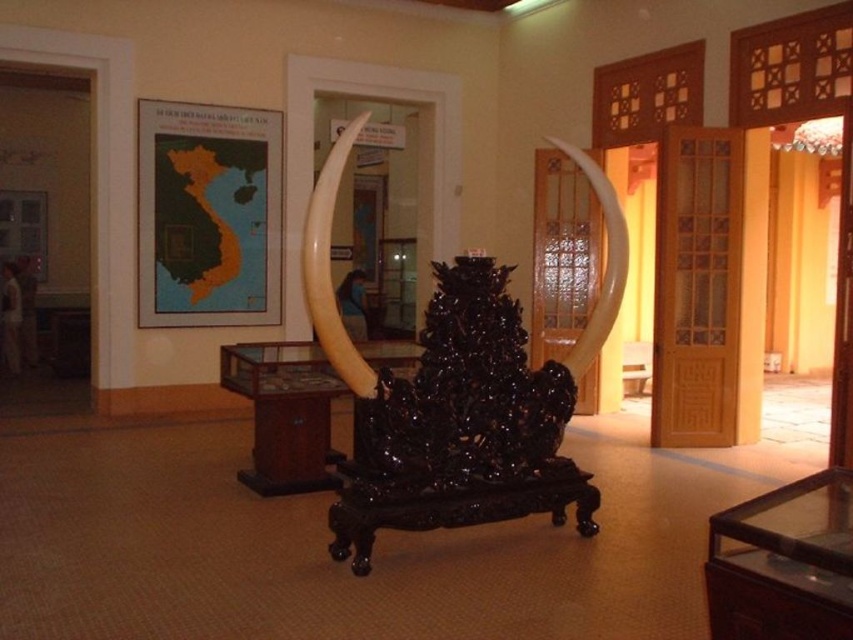
You are an art curator planning to move the black polished wood sculpture at center and the ivory tusk at center to a new gallery space. The new space has a narrow doorway that allows objects up to 1.2 meters in width. Based on the current dimensions, which object might require careful handling to ensure it fits through the doorway?

The black polished wood sculpture at center has a larger width than the ivory tusk at center, so it might require careful handling to ensure it fits through the doorway since it could exceed the 1.2 meters width limit.

You are standing in the museum and want to take a photo of the black polished wood sculpture at center. If you are positioned at point 0.5, 0.5, which direction should you move to get a better view?

Since the black polished wood sculpture at center is located at point (457, 392), you should move northeast to get a better view.